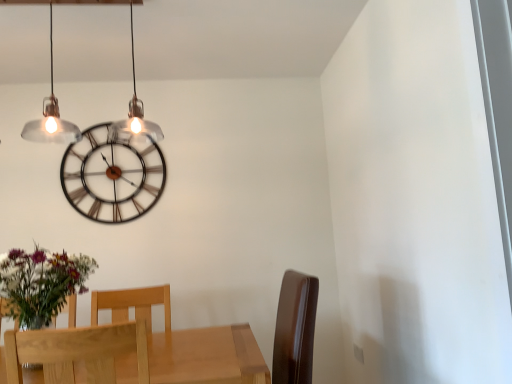
Based on the photo, measure the distance between point (x=113, y=213) and camera.

Point (x=113, y=213) is 9.53 feet from camera.

In the scene shown: Measure the distance between light wood chair at lower left, positioned as the 2th chair in front-to-back order, and camera.

The distance of light wood chair at lower left, positioned as the 2th chair in front-to-back order, from camera is 2.11 meters.

Locate an element on the screen. The height and width of the screenshot is (384, 512). light brown wood chair at lower left, the 2th chair in the back-to-front sequence is located at coordinates (77, 352).

Consider the image. How many degrees apart are the facing directions of metallic wire clock at upper center and clear glass pendant lights at upper left?

2.84 degrees separate the facing orientations of metallic wire clock at upper center and clear glass pendant lights at upper left.

Based on the photo, which of these two, metallic wire clock at upper center or clear glass pendant lights at upper left, is wider?

clear glass pendant lights at upper left is wider.

Image resolution: width=512 pixels, height=384 pixels. I want to click on lamp above the metallic wire clock at upper center (from the image's perspective), so click(51, 117).

From a real-world perspective, is metallic wire clock at upper center located beneath clear glass pendant lights at upper left?

Correct, in the physical world, metallic wire clock at upper center is lower than clear glass pendant lights at upper left.

From a real-world perspective, who is located lower, light wood chair at lower left, positioned as the 2th chair in front-to-back order, or clear glass pendant lights at upper left?

light wood chair at lower left, positioned as the 2th chair in front-to-back order, from a real-world perspective.

This screenshot has width=512, height=384. In order to click on lamp located above the light wood chair at lower left, the first chair in the back-to-front sequence (from a real-world perspective) in this screenshot , I will do `click(51, 117)`.

From the image's perspective, who appears lower, light wood chair at lower left, positioned as the 2th chair in front-to-back order, or clear glass pendant lights at upper left?

light wood chair at lower left, positioned as the 2th chair in front-to-back order, appears lower in the image.

Considering the positions of points (112, 292) and (139, 101), is point (112, 292) farther from camera compared to point (139, 101)?

That is False.

Is clear glass pendant lights at upper left facing towards light wood chair at lower left, the first chair in the back-to-front sequence?

No, clear glass pendant lights at upper left is not aimed at light wood chair at lower left, the first chair in the back-to-front sequence.

Based on the photo, from the image's perspective, between clear glass pendant lights at upper left and light wood chair at lower left, positioned as the 2th chair in front-to-back order, who is located below?

light wood chair at lower left, positioned as the 2th chair in front-to-back order, is shown below in the image.

Locate an element on the screen. This screenshot has width=512, height=384. lamp above the light wood chair at lower left, the first chair in the back-to-front sequence (from a real-world perspective) is located at coordinates (51, 117).

Does clear glass pendant lights at upper left have a greater height compared to metallic wire clock at upper center?

In fact, clear glass pendant lights at upper left may be shorter than metallic wire clock at upper center.

Is metallic wire clock at upper center at the back of clear glass pendant lights at upper left?

Yes, clear glass pendant lights at upper left's orientation is away from metallic wire clock at upper center.

From a real-world perspective, is clear glass pendant lights at upper left above or below metallic wire clock at upper center?

In terms of real-world spatial position, clear glass pendant lights at upper left is above metallic wire clock at upper center.

Is point (41, 126) closer to camera compared to point (124, 217)?

Yes, it is in front of point (124, 217).

Is light brown wood chair at lower left, acting as the first chair starting from the front, closer to camera compared to light wood chair at lower left, the first chair in the back-to-front sequence?

That is True.

Which is correct: light brown wood chair at lower left, the 2th chair in the back-to-front sequence, is inside light wood chair at lower left, positioned as the 2th chair in front-to-back order, or outside of it?

light brown wood chair at lower left, the 2th chair in the back-to-front sequence, is outside light wood chair at lower left, positioned as the 2th chair in front-to-back order.

Based on the photo, are light brown wood chair at lower left, the 2th chair in the back-to-front sequence, and light wood chair at lower left, positioned as the 2th chair in front-to-back order, making contact?

light brown wood chair at lower left, the 2th chair in the back-to-front sequence, is not next to light wood chair at lower left, positioned as the 2th chair in front-to-back order, and they're not touching.

From the picture: Considering the sizes of objects light brown wood chair at lower left, the 2th chair in the back-to-front sequence, and light wood chair at lower left, the first chair in the back-to-front sequence, in the image provided, who is bigger, light brown wood chair at lower left, the 2th chair in the back-to-front sequence, or light wood chair at lower left, the first chair in the back-to-front sequence,?

With larger size is light brown wood chair at lower left, the 2th chair in the back-to-front sequence.

Between clear glass pendant lights at upper left and light brown wood chair at lower left, acting as the first chair starting from the front, which one has smaller size?

light brown wood chair at lower left, acting as the first chair starting from the front, is smaller.

Is clear glass pendant lights at upper left at the left side of light brown wood chair at lower left, the 2th chair in the back-to-front sequence?

Yes.

Identify the location of chair in front of the clear glass pendant lights at upper left. (77, 352).

Can you confirm if clear glass pendant lights at upper left is shorter than light brown wood chair at lower left, the 2th chair in the back-to-front sequence?

Incorrect, the height of clear glass pendant lights at upper left does not fall short of that of light brown wood chair at lower left, the 2th chair in the back-to-front sequence.

Image resolution: width=512 pixels, height=384 pixels. Find the location of `the 2nd chair directly beneath the metallic wire clock at upper center (from a real-world perspective)`. the 2nd chair directly beneath the metallic wire clock at upper center (from a real-world perspective) is located at coordinates (77, 352).

In the scene shown: Which is closer, (104, 373) or (106, 201)?

Point (104, 373) appears to be closer to the viewer than point (106, 201).

Looking at their sizes, would you say light brown wood chair at lower left, acting as the first chair starting from the front, is wider or thinner than metallic wire clock at upper center?

In the image, light brown wood chair at lower left, acting as the first chair starting from the front, appears to be wider than metallic wire clock at upper center.

Locate an element on the screen. This screenshot has height=384, width=512. wall clock located behind the clear glass pendant lights at upper left is located at coordinates (112, 176).

Starting from the clear glass pendant lights at upper left, which chair is the 1st one to the right? Please provide its 2D coordinates.

[(133, 306)]

Estimate the real-world distances between objects in this image. Which object is further from metallic wire clock at upper center, clear glass pendant lights at upper left or light wood chair at lower left, the first chair in the back-to-front sequence?

light wood chair at lower left, the first chair in the back-to-front sequence, is positioned further to the anchor metallic wire clock at upper center.

Looking at this image, looking at the image, which one is located closer to clear glass pendant lights at upper left, metallic wire clock at upper center or light wood chair at lower left, positioned as the 2th chair in front-to-back order?

metallic wire clock at upper center is positioned closer to the anchor clear glass pendant lights at upper left.

Which object lies nearer to the anchor point light wood chair at lower left, the first chair in the back-to-front sequence, light brown wood chair at lower left, acting as the first chair starting from the front, or clear glass pendant lights at upper left?

The object closer to light wood chair at lower left, the first chair in the back-to-front sequence, is light brown wood chair at lower left, acting as the first chair starting from the front.

From the image, which object appears to be nearer to light brown wood chair at lower left, acting as the first chair starting from the front, light wood chair at lower left, positioned as the 2th chair in front-to-back order, or clear glass pendant lights at upper left?

light wood chair at lower left, positioned as the 2th chair in front-to-back order, is closer to light brown wood chair at lower left, acting as the first chair starting from the front.

When comparing their distances from light wood chair at lower left, the first chair in the back-to-front sequence, does light brown wood chair at lower left, the 2th chair in the back-to-front sequence, or metallic wire clock at upper center seem closer?

light brown wood chair at lower left, the 2th chair in the back-to-front sequence, is positioned closer to the anchor light wood chair at lower left, the first chair in the back-to-front sequence.

From the image, which object appears to be nearer to light wood chair at lower left, the first chair in the back-to-front sequence, clear glass pendant lights at upper left or light brown wood chair at lower left, acting as the first chair starting from the front?

Based on the image, light brown wood chair at lower left, acting as the first chair starting from the front, appears to be nearer to light wood chair at lower left, the first chair in the back-to-front sequence.

Looking at the image, which one is located closer to light brown wood chair at lower left, acting as the first chair starting from the front, clear glass pendant lights at upper left or metallic wire clock at upper center?

Based on the image, metallic wire clock at upper center appears to be nearer to light brown wood chair at lower left, acting as the first chair starting from the front.

Considering their positions, is light wood chair at lower left, the first chair in the back-to-front sequence, positioned further to metallic wire clock at upper center than light brown wood chair at lower left, the 2th chair in the back-to-front sequence?

The object further to metallic wire clock at upper center is light brown wood chair at lower left, the 2th chair in the back-to-front sequence.

Identify the location of wall clock that lies between clear glass pendant lights at upper left and light wood chair at lower left, the first chair in the back-to-front sequence, from top to bottom. This screenshot has height=384, width=512. (112, 176).

This screenshot has width=512, height=384. Find the location of `chair between clear glass pendant lights at upper left and light wood chair at lower left, the first chair in the back-to-front sequence, in the vertical direction`. chair between clear glass pendant lights at upper left and light wood chair at lower left, the first chair in the back-to-front sequence, in the vertical direction is located at coordinates (77, 352).

Where is `lamp between light brown wood chair at lower left, acting as the first chair starting from the front, and metallic wire clock at upper center in the front-back direction`? This screenshot has height=384, width=512. lamp between light brown wood chair at lower left, acting as the first chair starting from the front, and metallic wire clock at upper center in the front-back direction is located at coordinates (51, 117).

Find the location of `chair between light brown wood chair at lower left, acting as the first chair starting from the front, and metallic wire clock at upper center in the front-back direction`. chair between light brown wood chair at lower left, acting as the first chair starting from the front, and metallic wire clock at upper center in the front-back direction is located at coordinates (133, 306).